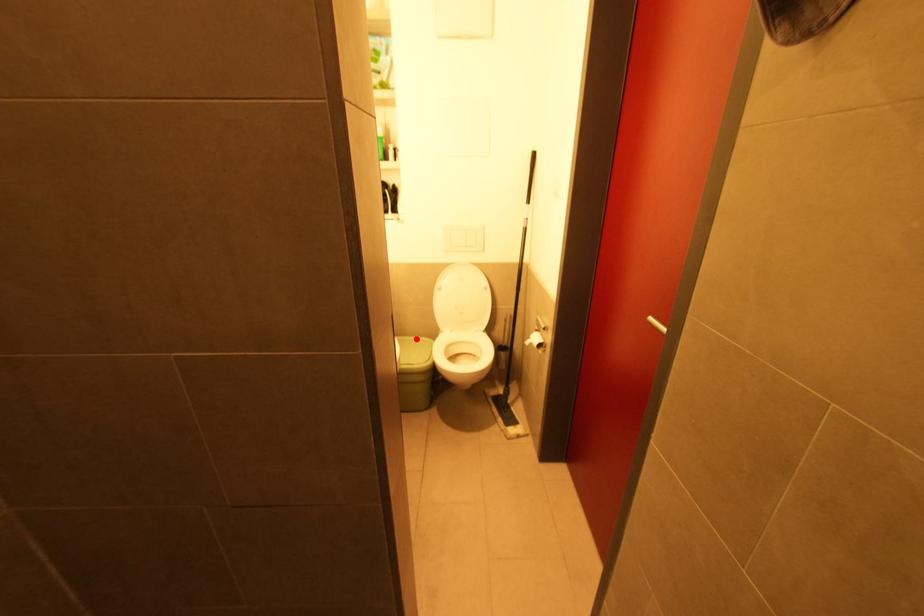
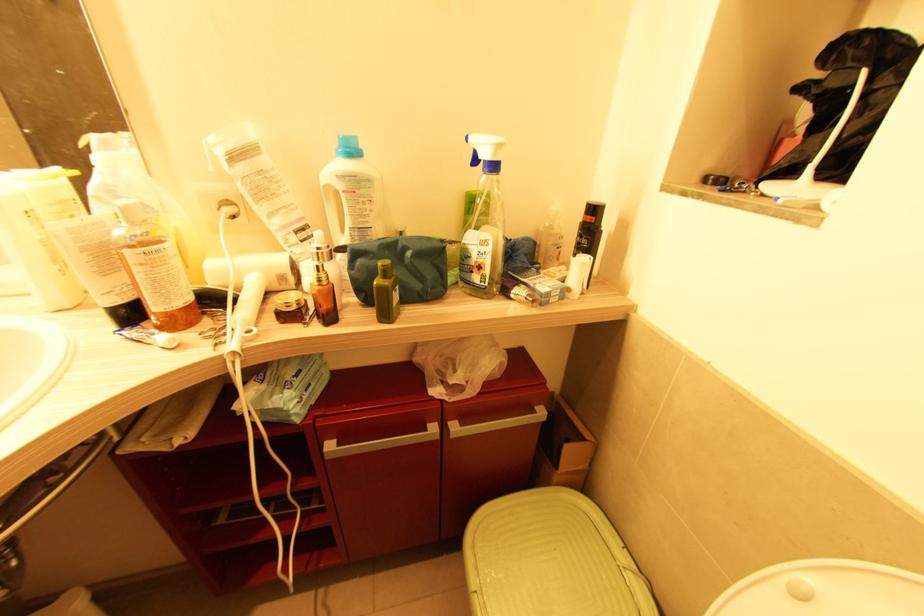
Where in the second image is the point corresponding to the highlighted location from the first image?

(626, 570)